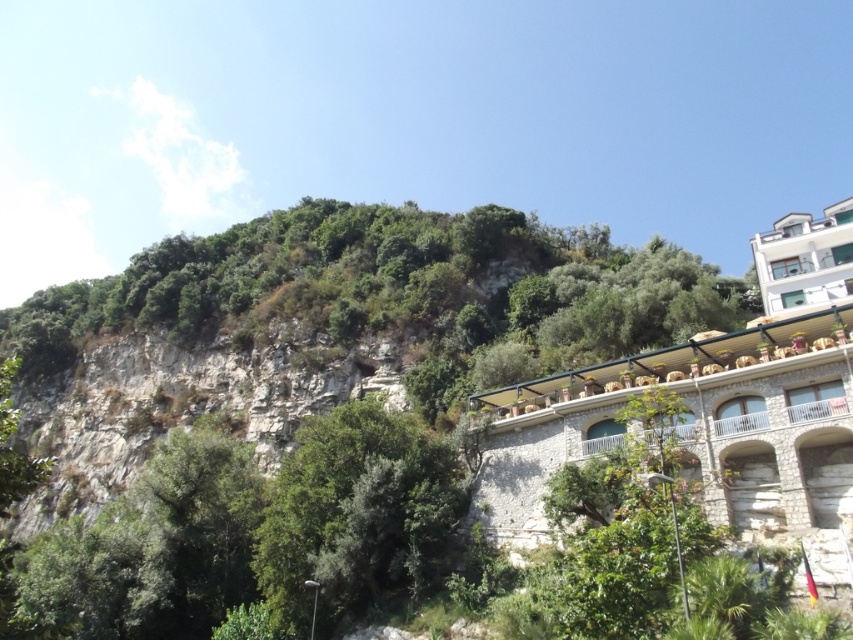
You are standing at the point marked by the coordinates point (357, 513) in the image, which is the green leafy tree at center. Looking around, what do you see to your immediate left and right?

To your immediate left, you see a steep, rocky cliff covered with dense greenery, and to your right, there is a multi story building with a light beige stone facade. The point (357, 513) corresponds to the green leafy tree at center.

You are planning to install a pathway between the two green leafy trees mentioned. Given that the pathway must be at least 50 feet long to accommodate all planned features, will the distance between the green leafy tree at upper center and the green leafy tree at center be sufficient?

The distance between the green leafy tree at upper center and the green leafy tree at center is 52.95 feet, which exceeds the required 50 feet. Therefore, the pathway can be installed between them as planned.